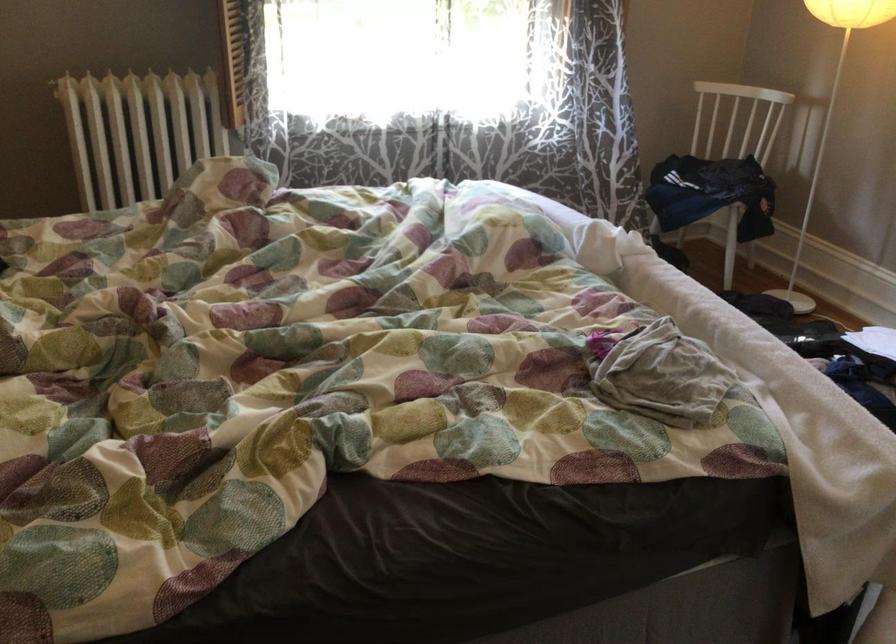
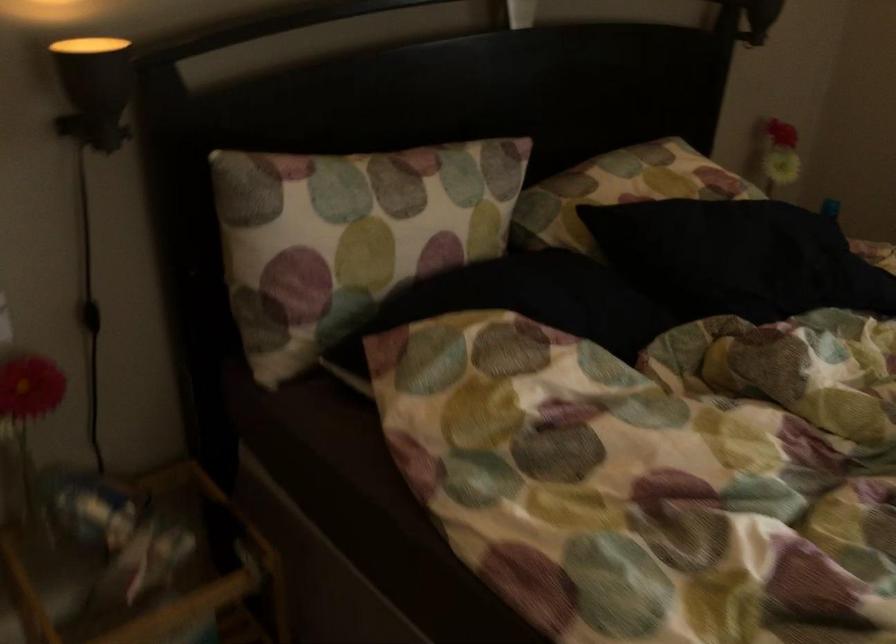
The first image is from the beginning of the video and the second image is from the end. How did the camera likely rotate when shooting the video?

The camera rotated toward left-down.